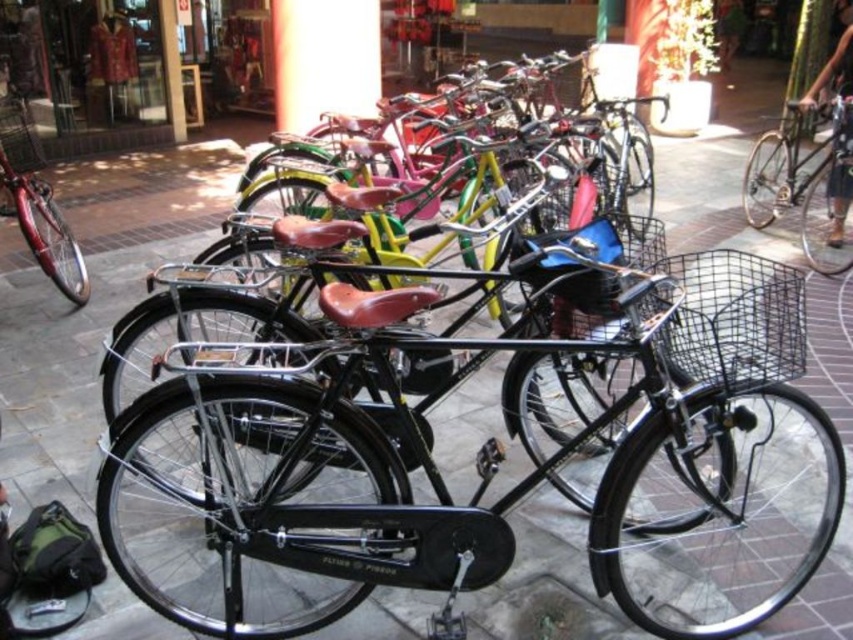
You are standing in front of the row of bicycles and want to locate two specific points marked on the pavement. The first point is at coordinate point (784, 154) and the second is at point (59, 268). Which point is closer to your current position?

Point (784, 154) is further to the viewer than point (59, 268), so the point closer to your current position is point (59, 268).